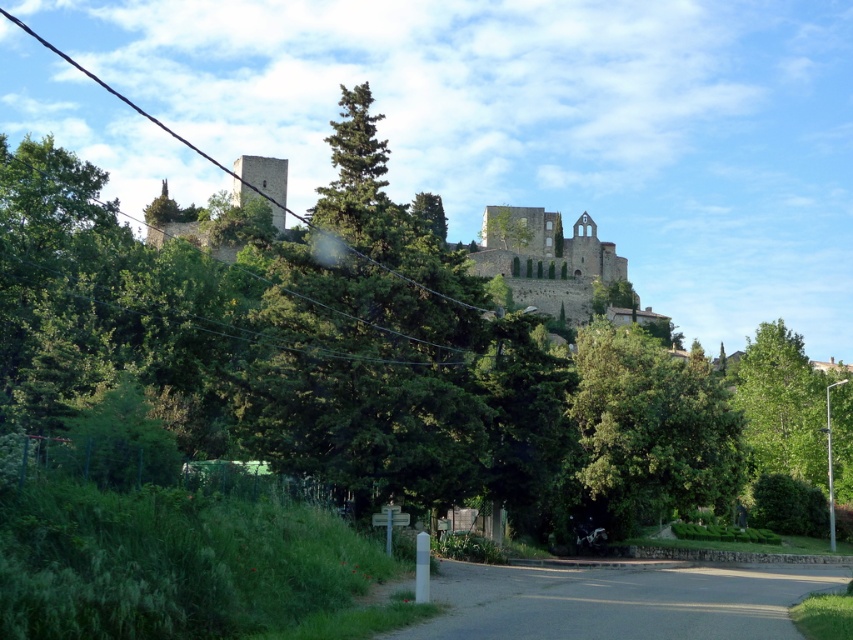
Question: Is green leafy tree at upper center in front of stone castle at upper center?

Choices:
 (A) no
 (B) yes

Answer: (B)

Question: Can you confirm if green leafy tree at upper center is positioned to the left of stone castle at upper center?

Choices:
 (A) yes
 (B) no

Answer: (A)

Question: Is green leafy tree at upper center above stone castle at upper center?

Choices:
 (A) no
 (B) yes

Answer: (A)

Question: Which of the following is the closest to the observer?

Choices:
 (A) (227, 209)
 (B) (611, 342)

Answer: (B)

Question: Among these objects, which one is farthest from the camera?

Choices:
 (A) green leafy tree at upper center
 (B) stone castle at upper center

Answer: (B)

Question: Based on their relative distances, which object is farther from the green leafy tree at center?

Choices:
 (A) green leafy tree at upper center
 (B) stone castle at upper center

Answer: (B)